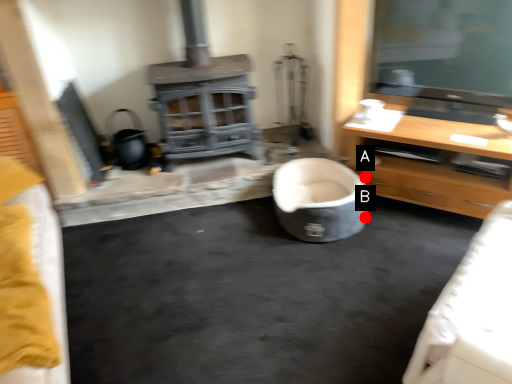
Question: Two points are circled on the image, labeled by A and B beside each circle. Which of the following is the farthest from the observer?

Choices:
 (A) A is further
 (B) B is further

Answer: (A)